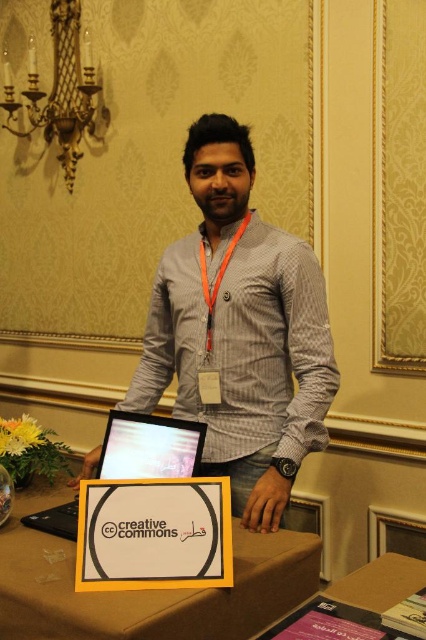
Question: Which object appears farthest from the camera in this image?

Choices:
 (A) yellow fabric table at center
 (B) orange fabric lanyard at center

Answer: (B)

Question: Is yellow fabric table at center below white paper at center?

Choices:
 (A) no
 (B) yes

Answer: (B)

Question: Among these objects, which one is nearest to the camera?

Choices:
 (A) orange fabric lanyard at center
 (B) yellow fabric table at center
 (C) satin black laptop at center

Answer: (B)

Question: Is gray woven shirt at center thinner than satin black laptop at center?

Choices:
 (A) no
 (B) yes

Answer: (A)

Question: Does orange fabric lanyard at center have a greater width compared to skinny orange lanyard at center?

Choices:
 (A) no
 (B) yes

Answer: (B)

Question: Among these points, which one is farthest from the camera?

Choices:
 (A) (204, 627)
 (B) (206, 285)

Answer: (B)